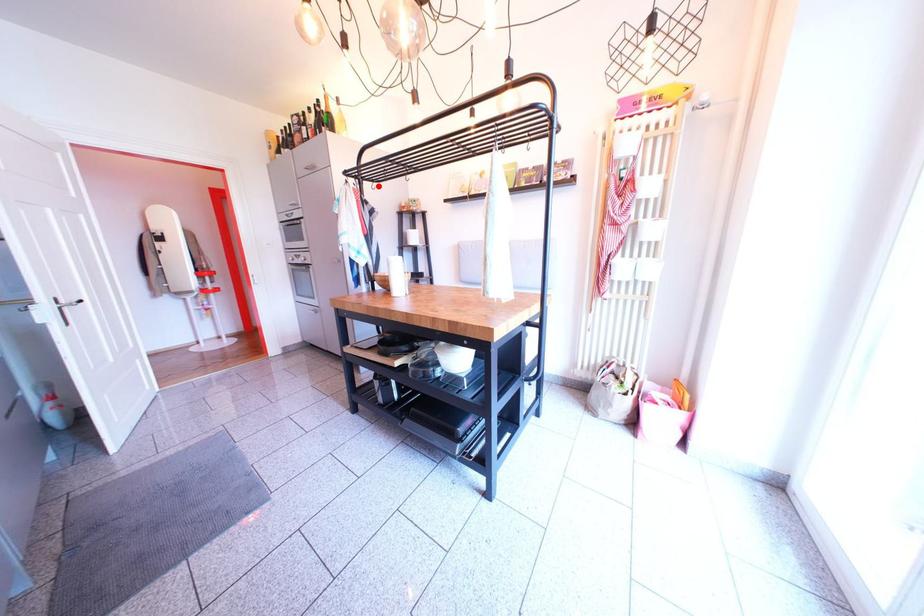
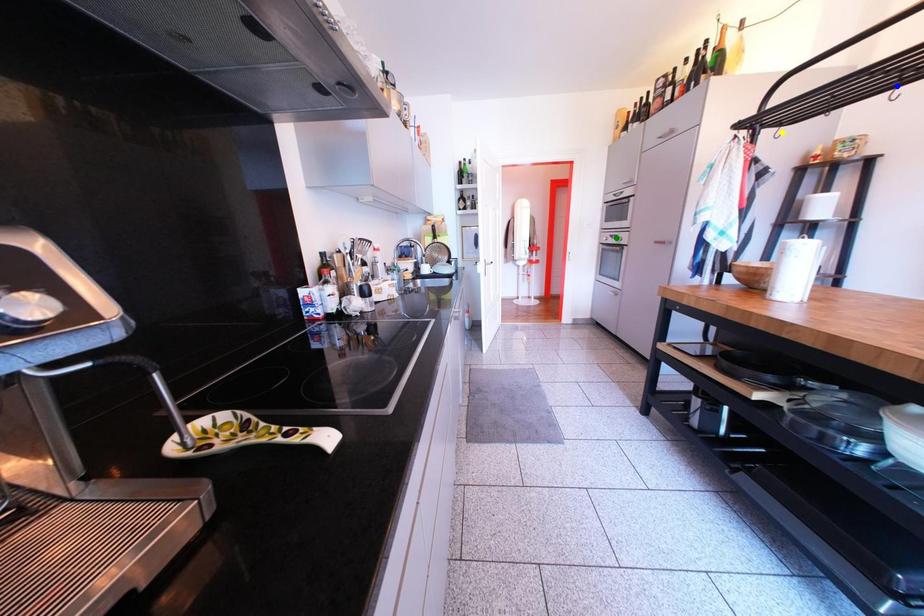
Question: I am providing you with two images of the same scene from different viewpoints. A red point is marked on the first image. You are given multiple points on the second image. Which mark in image 2 goes with the point in image 1?

Choices:
 (A) yellow point
 (B) blue point
 (C) green point

Answer: (A)